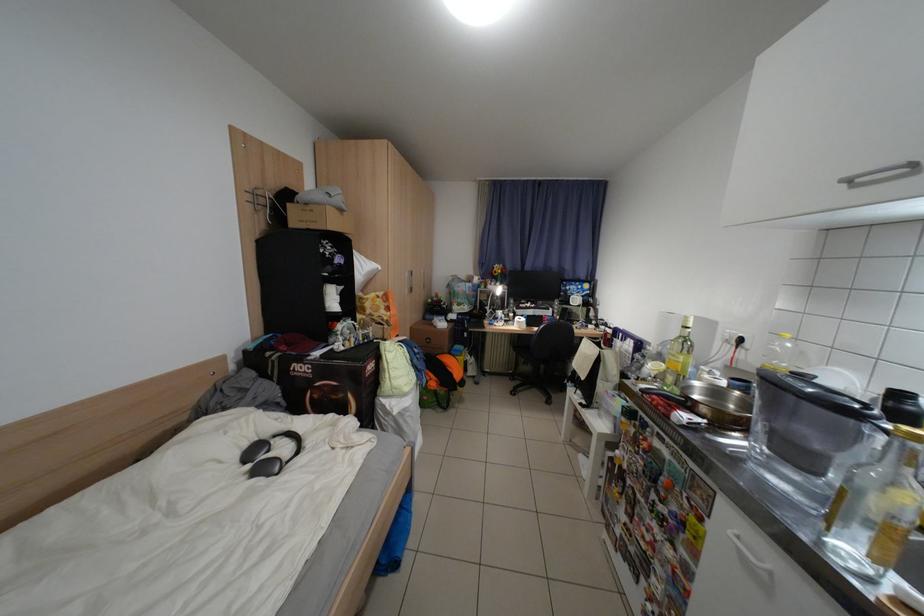
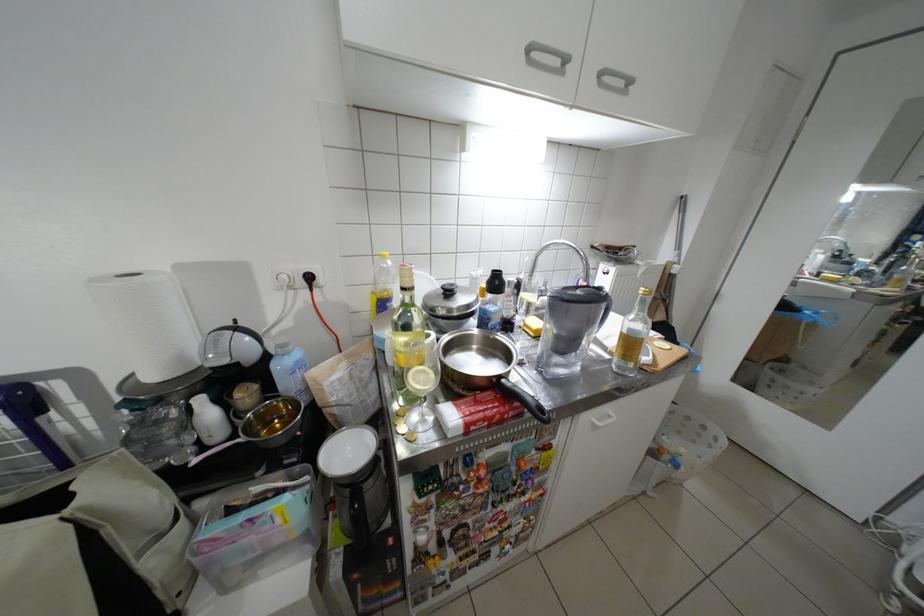
In the second image, find the point that corresponds to [860,182] in the first image.

(541, 51)